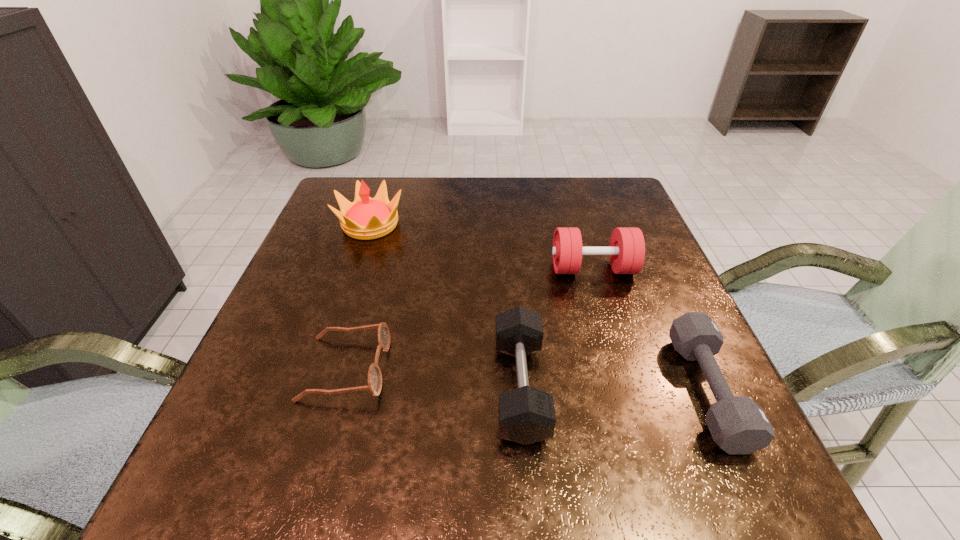
Find the location of a particular element. The width and height of the screenshot is (960, 540). free spot that satisfies the following two spatial constraints: 1. on the front side of the shortest dumbbell; 2. on the left side of the tallest object is located at coordinates (316, 391).